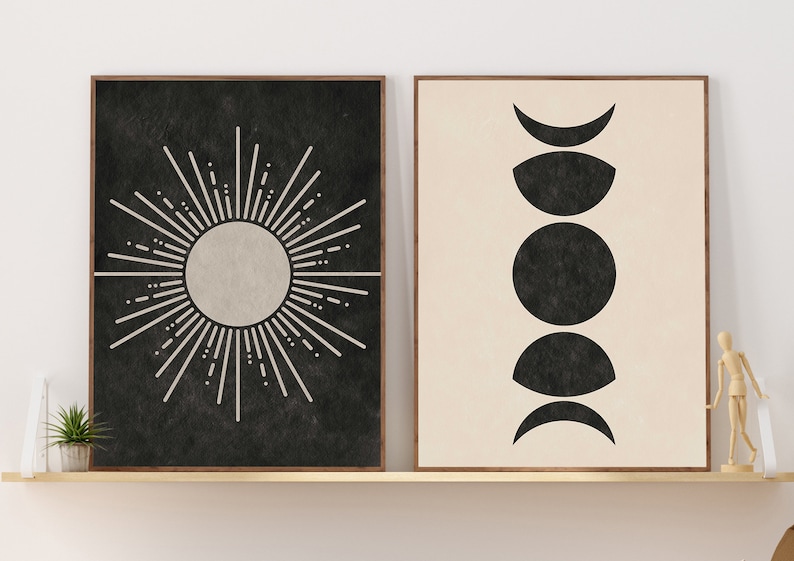
Find the location of a particular element. Image resolution: width=794 pixels, height=561 pixels. plant pot is located at coordinates (79, 454).